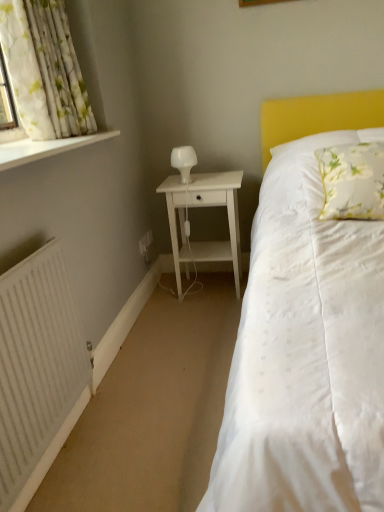
Question: Is white floral fabric curtain at upper left in front of or behind white wood nightstand at center in the image?

Choices:
 (A) front
 (B) behind

Answer: (A)

Question: Considering the positions of white floral fabric curtain at upper left and white wood nightstand at center in the image, is white floral fabric curtain at upper left bigger or smaller than white wood nightstand at center?

Choices:
 (A) big
 (B) small

Answer: (B)

Question: Considering the real-world distances, which object is closest to the white wood nightstand at center?

Choices:
 (A) floral fabric pillow at upper right
 (B) white painted wood at left
 (C) white glossy table lamp at center
 (D) white floral fabric curtain at upper left
 (E) white matte radiator at lower left

Answer: (C)

Question: Considering the real-world distances, which object is farthest from the white floral fabric curtain at upper left?

Choices:
 (A) floral fabric pillow at upper right
 (B) white glossy table lamp at center
 (C) white painted wood at left
 (D) white matte radiator at lower left
 (E) white wood nightstand at center

Answer: (A)